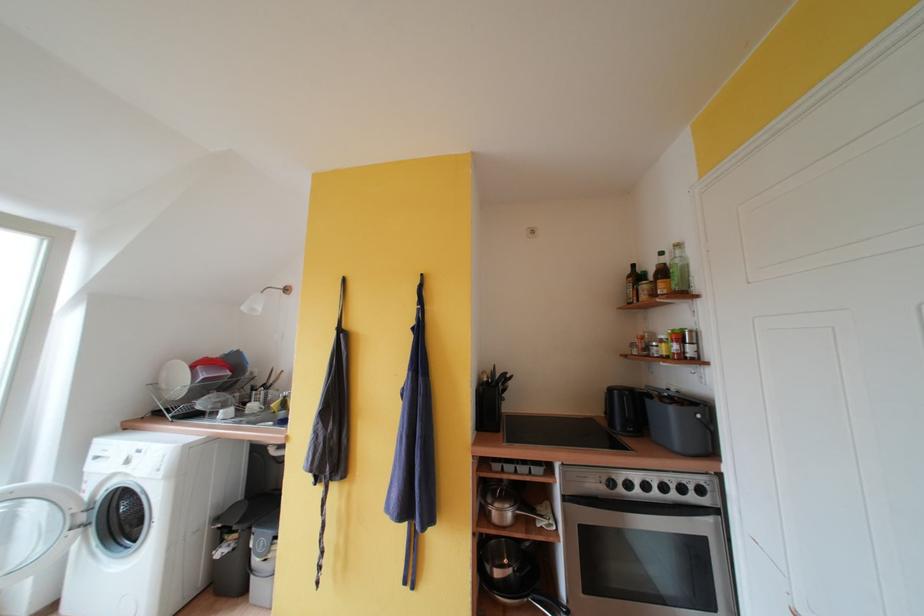
You are a GUI agent. You are given a task and a screenshot of the screen. Output one action in this format:
    pyautogui.click(x=<x>, y=<y>)
    Task: Click on the green glass bottle
    This screenshot has height=616, width=924.
    Given the screenshot: What is the action you would take?
    (x=678, y=268)